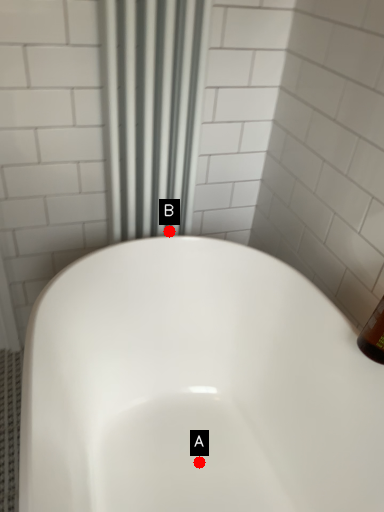
Question: Two points are circled on the image, labeled by A and B beside each circle. Which point is farther to the camera?

Choices:
 (A) A is further
 (B) B is further

Answer: (B)